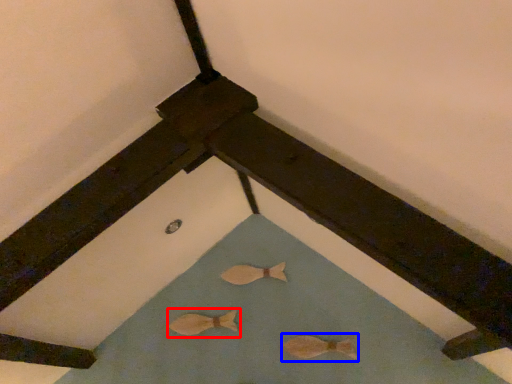
Question: Which point is closer to the camera, animal (highlighted by a red box) or animal (highlighted by a blue box)?

Choices:
 (A) animal
 (B) animal

Answer: (B)